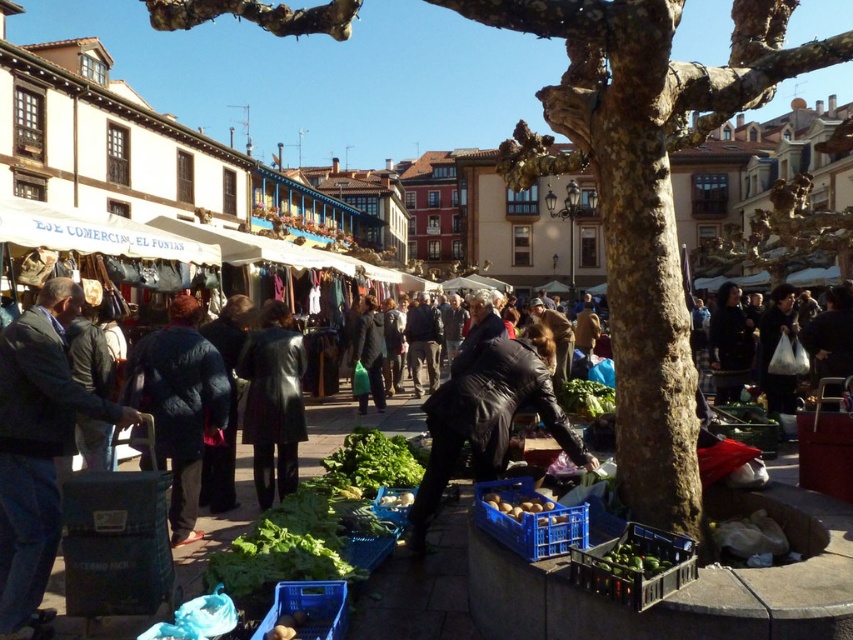
You are standing at the entrance of the market and want to find the dark fabric coat at center. According to the coordinates provided, where should you look relative to the entrance?

The dark fabric coat at center is located at coordinates point (x=730, y=342), which would be towards the center of the market, so you should look towards the central area of the market.

You are a photographer wanting to capture both the dark blue suit at left and the green leafy vegetables at center in a single frame. Which object should you focus on first to ensure both are in the frame?

The dark blue suit at left has a lesser width compared to green leafy vegetables at center, so you should focus on the green leafy vegetables at center first to ensure both are in the frame.